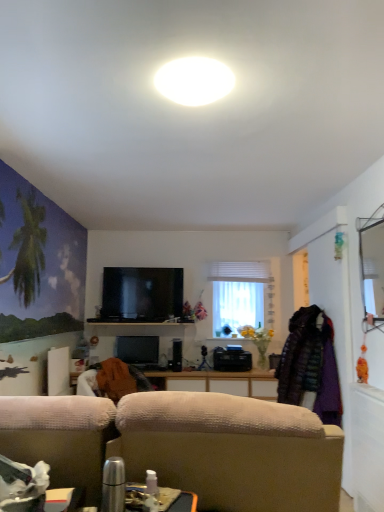
Question: Are black glossy flat-screen tv at center, which appears as the second television when ordered from the bottom, and black glossy television at center, which is counted as the first television, starting from the bottom, beside each other?

Choices:
 (A) yes
 (B) no

Answer: (B)

Question: Is black glossy flat-screen tv at center, which appears as the second television when ordered from the bottom, turned away from black glossy television at center, which is counted as the first television, starting from the bottom?

Choices:
 (A) yes
 (B) no

Answer: (B)

Question: Is black glossy flat-screen tv at center, which appears as the second television when ordered from the bottom, at the left side of black glossy television at center, which is counted as the first television, starting from the bottom?

Choices:
 (A) yes
 (B) no

Answer: (B)

Question: From the image's perspective, is black glossy flat-screen tv at center, the first television viewed from the top, above black glossy television at center, the second television positioned from the top?

Choices:
 (A) no
 (B) yes

Answer: (B)

Question: From a real-world perspective, is black glossy flat-screen tv at center, which appears as the second television when ordered from the bottom, physically above black glossy television at center, which is counted as the first television, starting from the bottom?

Choices:
 (A) no
 (B) yes

Answer: (B)

Question: Can you confirm if black glossy flat-screen tv at center, the first television viewed from the top, is bigger than black glossy television at center, the second television positioned from the top?

Choices:
 (A) yes
 (B) no

Answer: (A)

Question: From a real-world perspective, is black glossy television at center, the second television positioned from the top, physically above white sheer curtain at center?

Choices:
 (A) no
 (B) yes

Answer: (A)

Question: Is black glossy television at center, the second television positioned from the top, placed right next to white sheer curtain at center?

Choices:
 (A) no
 (B) yes

Answer: (A)

Question: Is black glossy television at center, which is counted as the first television, starting from the bottom, bigger than white sheer curtain at center?

Choices:
 (A) yes
 (B) no

Answer: (B)

Question: Considering the relative sizes of black glossy television at center, which is counted as the first television, starting from the bottom, and white sheer curtain at center in the image provided, is black glossy television at center, which is counted as the first television, starting from the bottom, smaller than white sheer curtain at center?

Choices:
 (A) yes
 (B) no

Answer: (A)

Question: Does black glossy television at center, the second television positioned from the top, turn towards white sheer curtain at center?

Choices:
 (A) no
 (B) yes

Answer: (A)

Question: From the image's perspective, would you say black glossy television at center, the second television positioned from the top, is shown under white sheer curtain at center?

Choices:
 (A) yes
 (B) no

Answer: (A)

Question: Is black glossy flat-screen tv at center, the first television viewed from the top, taller than white glossy ceiling light at upper center?

Choices:
 (A) no
 (B) yes

Answer: (B)